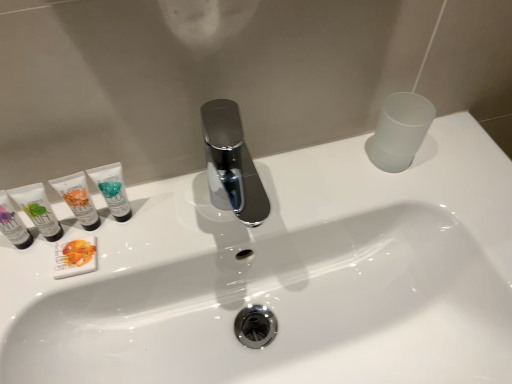
Question: Is point (42, 201) closer or farther from the camera than point (73, 258)?

Choices:
 (A) farther
 (B) closer

Answer: (A)

Question: Do you think matte white tube at left, which is counted as the second toiletry, starting from the left, is within white matte soap bar at left, the 3th toiletry from the left, or outside of it?

Choices:
 (A) inside
 (B) outside

Answer: (B)

Question: Estimate the real-world distances between objects in this image. Which object is closer to the white matte soap bar at left, the third toiletry positioned from the right?

Choices:
 (A) matte white tube at left, which is counted as the second toiletry, starting from the left
 (B) white matte tube at left, the 4th toiletry positioned from the left
 (C) white glossy sink at center
 (D) teal matte tube at left, the first toiletry when ordered from right to left
 (E) matte white tube at left, which is the 1th toiletry from left to right

Answer: (A)

Question: Estimate the real-world distances between objects in this image. Which object is farther from the white glossy sink at center?

Choices:
 (A) white matte soap bar at left, the 3th toiletry from the left
 (B) teal matte tube at left, the first toiletry when ordered from right to left
 (C) matte white tube at left, which is counted as the second toiletry, starting from the left
 (D) matte white tube at left, which is the 1th toiletry from left to right
 (E) white matte tube at left, the 4th toiletry positioned from the left

Answer: (D)